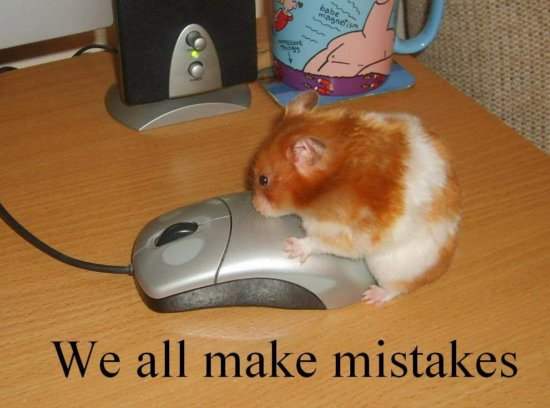
You are a GUI agent. You are given a task and a screenshot of the screen. Output one action in this format:
    pyautogui.click(x=<x>, y=<y>)
    Task: Click on the cord
    
    Given the screenshot: What is the action you would take?
    [100, 268], [22, 230]